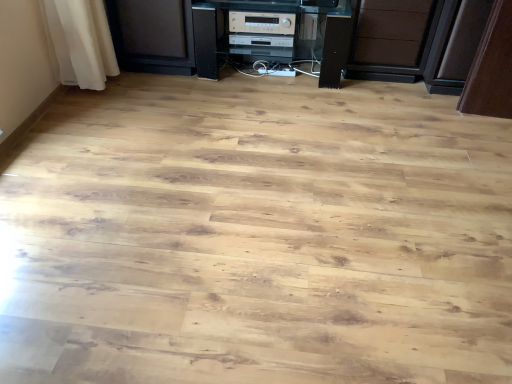
At what (x,y) coordinates should I click in order to perform the action: click on free space between brown matte drawer at center and black plastic stereo at center. Please return your answer as a coordinate pair (x, y). Looking at the image, I should click on (365, 89).